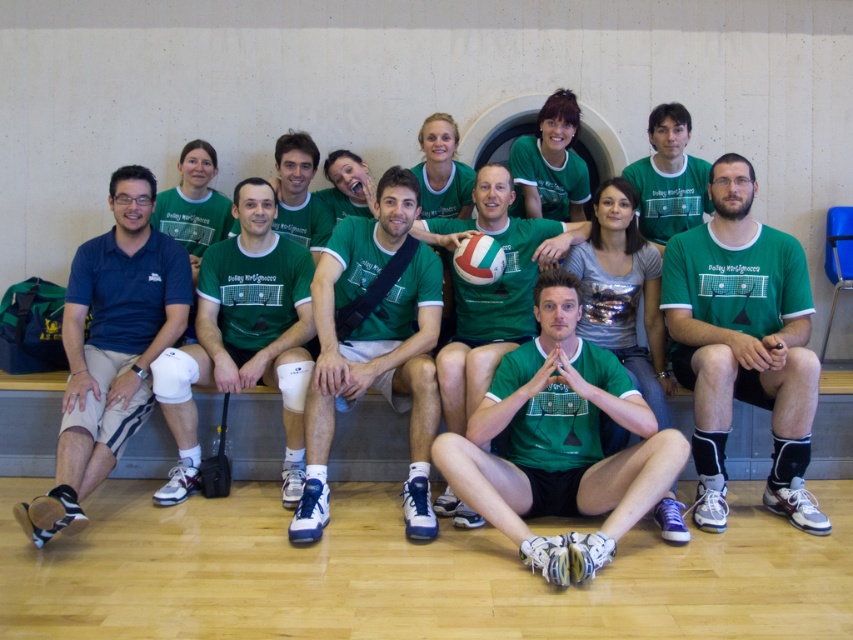
Question: Which point is farther to the camera?

Choices:
 (A) green matte/vinyl volleyball at center
 (B) green jersey at center

Answer: (A)

Question: Which object is closer to the camera taking this photo?

Choices:
 (A) green matte knee pads at center
 (B) green matte/vinyl t-shirt at center
 (C) green matte shirt at center
 (D) green matte/vinyl volleyball at center

Answer: (B)

Question: Considering the real-world distances, which object is closest to the matte blue polo shirt at left?

Choices:
 (A) green matte/vinyl volleyball at center
 (B) green matte knee pads at center
 (C) green matte/vinyl shirt at center
 (D) green matte shirt at center

Answer: (B)

Question: Does green matte/vinyl t-shirt at center have a smaller size compared to green matte knee pads at center?

Choices:
 (A) no
 (B) yes

Answer: (A)

Question: Does green matte/vinyl shirt at center have a smaller size compared to green matte knee pads at center?

Choices:
 (A) no
 (B) yes

Answer: (A)

Question: Does green matte/vinyl shirt at center appear over green matte knee pads at center?

Choices:
 (A) yes
 (B) no

Answer: (B)